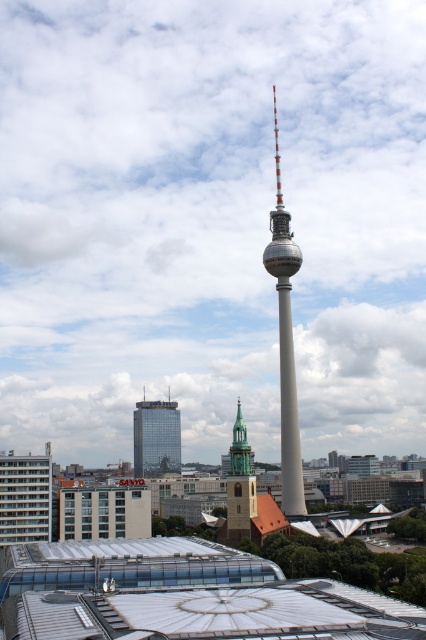
Question: Which point is farther to the camera?

Choices:
 (A) white textured roof at lower center
 (B) smooth gray tower at center
 (C) glassy reflective skyscraper at center

Answer: (C)

Question: Can you confirm if white textured roof at lower center is positioned below green stone church steeple at center?

Choices:
 (A) yes
 (B) no

Answer: (B)

Question: Is white textured roof at lower center thinner than green stone church steeple at center?

Choices:
 (A) no
 (B) yes

Answer: (A)

Question: Is glassy reflective skyscraper at center to the left of green stone church steeple at center from the viewer's perspective?

Choices:
 (A) yes
 (B) no

Answer: (A)

Question: Which object is positioned closest to the white textured roof at lower center?

Choices:
 (A) green stone church steeple at center
 (B) glassy reflective skyscraper at center
 (C) smooth gray tower at center

Answer: (A)

Question: Which point is farther to the camera?

Choices:
 (A) pyautogui.click(x=244, y=483)
 (B) pyautogui.click(x=135, y=468)
 (C) pyautogui.click(x=294, y=484)

Answer: (B)